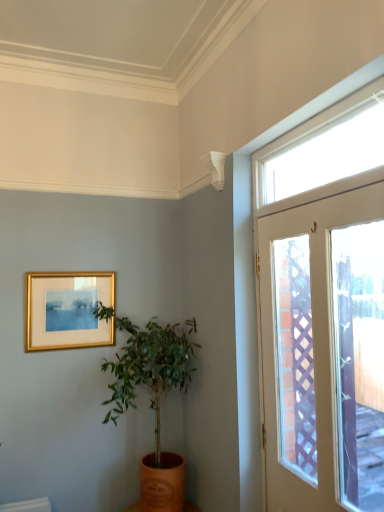
Question: Is gold metallic picture frame at upper left closer to camera compared to clear glass window at upper right?

Choices:
 (A) no
 (B) yes

Answer: (A)

Question: Would you say gold metallic picture frame at upper left is a long distance from clear glass window at upper right?

Choices:
 (A) yes
 (B) no

Answer: (A)

Question: Is gold metallic picture frame at upper left taller than clear glass window at upper right?

Choices:
 (A) yes
 (B) no

Answer: (A)

Question: Is gold metallic picture frame at upper left facing away from clear glass window at upper right?

Choices:
 (A) yes
 (B) no

Answer: (B)

Question: Would you say clear glass window at upper right is part of gold metallic picture frame at upper left's contents?

Choices:
 (A) no
 (B) yes

Answer: (A)

Question: In the image, is white glossy door at right positioned in front of or behind clear glass window at upper right?

Choices:
 (A) behind
 (B) front

Answer: (B)

Question: In terms of width, does white glossy door at right look wider or thinner when compared to clear glass window at upper right?

Choices:
 (A) wide
 (B) thin

Answer: (B)

Question: From a real-world perspective, relative to clear glass window at upper right, is white glossy door at right vertically above or below?

Choices:
 (A) below
 (B) above

Answer: (A)

Question: Would you say white glossy door at right is to the left or to the right of clear glass window at upper right in the picture?

Choices:
 (A) left
 (B) right

Answer: (B)

Question: Considering the positions of gold metallic picture frame at upper left and orange clay pot at center in the image, is gold metallic picture frame at upper left wider or thinner than orange clay pot at center?

Choices:
 (A) wide
 (B) thin

Answer: (B)

Question: Is gold metallic picture frame at upper left inside the boundaries of orange clay pot at center, or outside?

Choices:
 (A) outside
 (B) inside

Answer: (A)

Question: Is gold metallic picture frame at upper left taller or shorter than orange clay pot at center?

Choices:
 (A) tall
 (B) short

Answer: (B)

Question: Considering the positions of point (56, 333) and point (163, 352), is point (56, 333) closer or farther from the camera than point (163, 352)?

Choices:
 (A) closer
 (B) farther

Answer: (B)

Question: In terms of height, does orange clay pot at center look taller or shorter compared to gold metallic picture frame at upper left?

Choices:
 (A) short
 (B) tall

Answer: (B)

Question: In terms of width, does orange clay pot at center look wider or thinner when compared to gold metallic picture frame at upper left?

Choices:
 (A) wide
 (B) thin

Answer: (A)